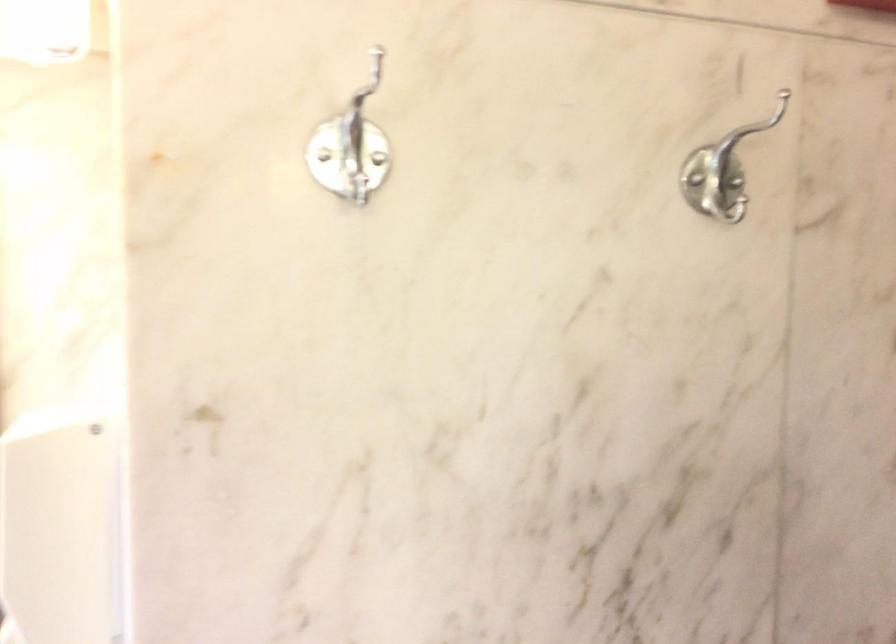
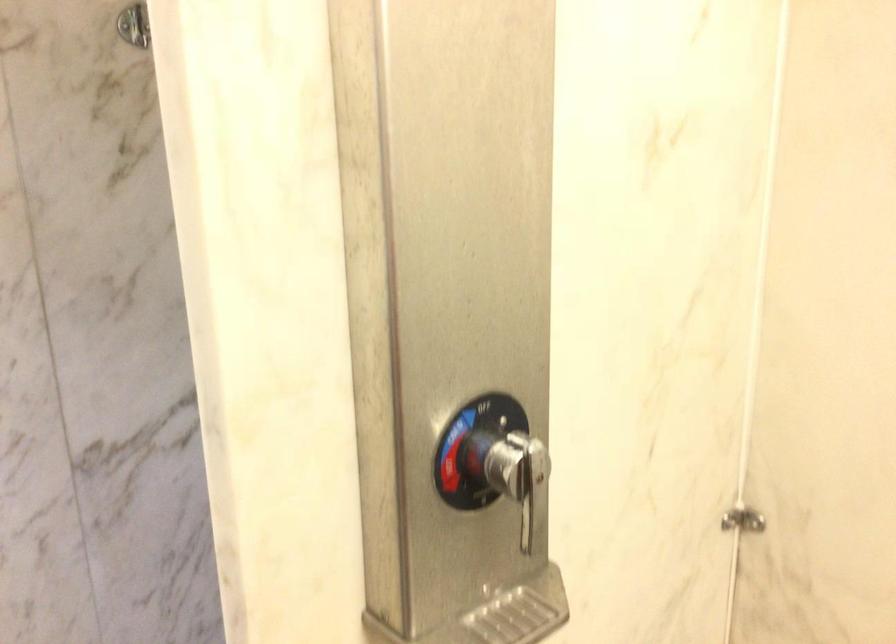
What movement of the cameraman would produce the second image?

The cameraman walked toward right, backward.